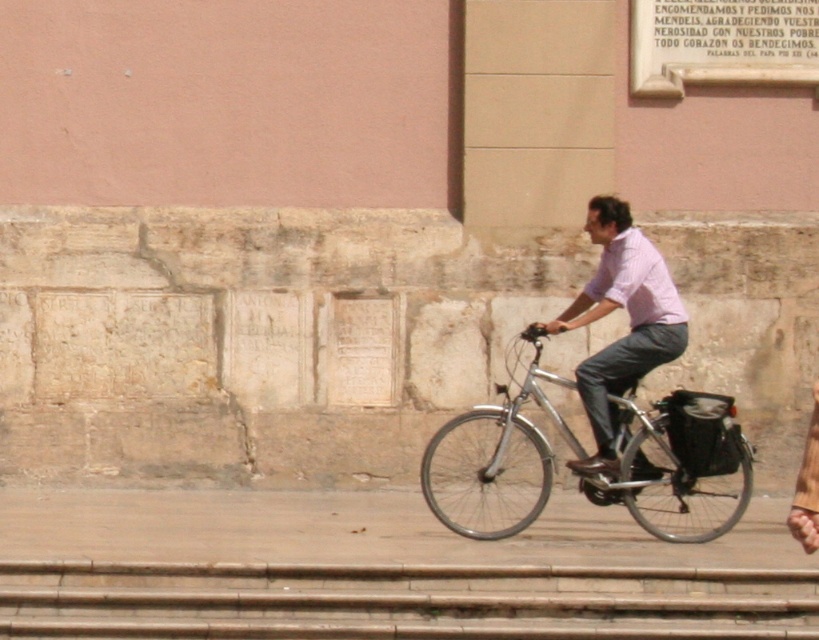
Is silver metallic bicycle at center to the left of pink cotton shirt at center from the viewer's perspective?

Yes, silver metallic bicycle at center is to the left of pink cotton shirt at center.

Which of these two, silver metallic bicycle at center or pink cotton shirt at center, stands shorter?

silver metallic bicycle at center is shorter.

The height and width of the screenshot is (640, 819). What are the coordinates of `silver metallic bicycle at center` in the screenshot? It's located at (675, 458).

At what (x,y) coordinates should I click in order to perform the action: click on silver metallic bicycle at center. Please return your answer as a coordinate pair (x, y). Looking at the image, I should click on (675, 458).